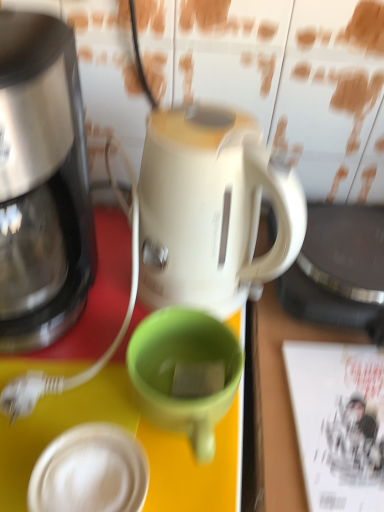
In order to click on green matte mug at center in this screenshot , I will do `click(185, 373)`.

Is white paper magazine at right positioned in front of shiny metallic coffee maker at left?

No, it is not.

Which object is wider, white paper magazine at right or shiny metallic coffee maker at left?

shiny metallic coffee maker at left.

Are white paper magazine at right and shiny metallic coffee maker at left far apart?

They are positioned close to each other.

The height and width of the screenshot is (512, 384). What are the coordinates of `magazine on the right of shiny metallic coffee maker at left` in the screenshot? It's located at (339, 423).

Is white paper magazine at right positioned before green matte mug at center?

No, white paper magazine at right is further to the viewer.

Locate an element on the screen. coffee cup in front of the white paper magazine at right is located at coordinates (185, 373).

Consider the image. Considering the relative sizes of white paper magazine at right and green matte mug at center in the image provided, is white paper magazine at right bigger than green matte mug at center?

Actually, white paper magazine at right might be smaller than green matte mug at center.

Is green matte mug at center turned away from shiny metallic coffee maker at left?

No, green matte mug at center's orientation is not away from shiny metallic coffee maker at left.

The width and height of the screenshot is (384, 512). I want to click on coffee maker on the left of green matte mug at center, so click(x=42, y=184).

Can you confirm if green matte mug at center is positioned to the left of shiny metallic coffee maker at left?

In fact, green matte mug at center is to the right of shiny metallic coffee maker at left.

Which is nearer, (230,402) or (17,314)?

Point (230,402)

Is shiny metallic coffee maker at left inside the boundaries of white matte lid at lower left, or outside?

shiny metallic coffee maker at left lies outside white matte lid at lower left.

Can you confirm if shiny metallic coffee maker at left is bigger than white matte lid at lower left?

Indeed, shiny metallic coffee maker at left has a larger size compared to white matte lid at lower left.

Is white matte lid at lower left at the back of shiny metallic coffee maker at left?

No.

From the picture: Measure the distance from shiny metallic coffee maker at left to white matte lid at lower left.

shiny metallic coffee maker at left and white matte lid at lower left are 10.61 inches apart.

Considering the sizes of white matte lid at lower left and green matte mug at center in the image, is white matte lid at lower left taller or shorter than green matte mug at center?

In the image, white matte lid at lower left appears to be shorter than green matte mug at center.

Considering their positions, is white matte lid at lower left located in front of or behind green matte mug at center?

white matte lid at lower left is positioned closer to the viewer than green matte mug at center.

Considering the relative sizes of white matte lid at lower left and green matte mug at center in the image provided, is white matte lid at lower left wider than green matte mug at center?

Incorrect, the width of white matte lid at lower left does not surpass that of green matte mug at center.

Find the location of a particular element. coffee cup above the white matte lid at lower left (from a real-world perspective) is located at coordinates (185, 373).

Is shiny metallic coffee maker at left to the left of green matte mug at center from the viewer's perspective?

Yes, shiny metallic coffee maker at left is to the left of green matte mug at center.

Between shiny metallic coffee maker at left and green matte mug at center, which one has less height?

With less height is green matte mug at center.

From a real-world perspective, between shiny metallic coffee maker at left and green matte mug at center, who is vertically lower?

green matte mug at center, from a real-world perspective.

Does shiny metallic coffee maker at left touch green matte mug at center?

No, shiny metallic coffee maker at left is not in contact with green matte mug at center.

From the picture: Is white paper magazine at right looking in the opposite direction of white matte lid at lower left?

No, white paper magazine at right is not facing away from white matte lid at lower left.

Considering their positions, is white paper magazine at right located in front of or behind white matte lid at lower left?

In the image, white paper magazine at right appears behind white matte lid at lower left.

Does white paper magazine at right have a greater height compared to white matte lid at lower left?

In fact, white paper magazine at right may be shorter than white matte lid at lower left.

Is white paper magazine at right at the right side of white matte lid at lower left?

Yes.

Where is `magazine behind the shiny metallic coffee maker at left`? The width and height of the screenshot is (384, 512). magazine behind the shiny metallic coffee maker at left is located at coordinates (339, 423).

Where is `magazine below the green matte mug at center (from the image's perspective)`? The height and width of the screenshot is (512, 384). magazine below the green matte mug at center (from the image's perspective) is located at coordinates (339, 423).

Which object lies further to the anchor point shiny metallic coffee maker at left, white paper magazine at right or green matte mug at center?

The object further to shiny metallic coffee maker at left is white paper magazine at right.

Considering their positions, is shiny metallic coffee maker at left positioned further to white matte lid at lower left than green matte mug at center?

Based on the image, shiny metallic coffee maker at left appears to be further to white matte lid at lower left.

From the image, which object appears to be nearer to white paper magazine at right, white matte lid at lower left or shiny metallic coffee maker at left?

white matte lid at lower left.

When comparing their distances from shiny metallic coffee maker at left, does white matte lid at lower left or green matte mug at center seem closer?

Among the two, green matte mug at center is located nearer to shiny metallic coffee maker at left.

When comparing their distances from green matte mug at center, does shiny metallic coffee maker at left or white paper magazine at right seem further?

shiny metallic coffee maker at left.

When comparing their distances from shiny metallic coffee maker at left, does white matte lid at lower left or white paper magazine at right seem further?

Based on the image, white paper magazine at right appears to be further to shiny metallic coffee maker at left.

When comparing their distances from shiny metallic coffee maker at left, does green matte mug at center or white matte lid at lower left seem closer?

Among the two, green matte mug at center is located nearer to shiny metallic coffee maker at left.

Considering their positions, is shiny metallic coffee maker at left positioned further to white matte lid at lower left than white paper magazine at right?

shiny metallic coffee maker at left lies further to white matte lid at lower left than the other object.

Where is `tableware between shiny metallic coffee maker at left and white paper magazine at right in the horizontal direction`? The image size is (384, 512). tableware between shiny metallic coffee maker at left and white paper magazine at right in the horizontal direction is located at coordinates (90, 472).

Where is `coffee cup between shiny metallic coffee maker at left and white matte lid at lower left from top to bottom`? The width and height of the screenshot is (384, 512). coffee cup between shiny metallic coffee maker at left and white matte lid at lower left from top to bottom is located at coordinates point(185,373).

Find the location of `coffee cup between shiny metallic coffee maker at left and white paper magazine at right from left to right`. coffee cup between shiny metallic coffee maker at left and white paper magazine at right from left to right is located at coordinates (185, 373).

Locate an element on the screen. The height and width of the screenshot is (512, 384). coffee cup located between white matte lid at lower left and white paper magazine at right in the left-right direction is located at coordinates (185, 373).